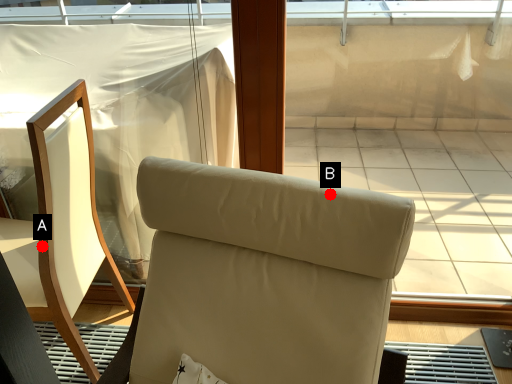
Question: Two points are circled on the image, labeled by A and B beside each circle. Among these points, which one is farthest from the camera?

Choices:
 (A) A is further
 (B) B is further

Answer: (A)